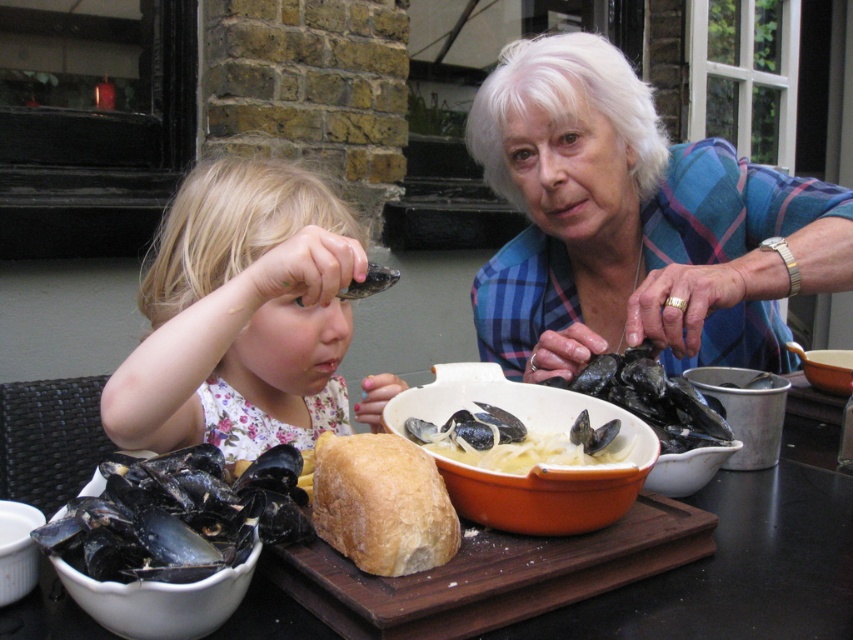
Question: Among these points, which one is farthest from the camera?

Choices:
 (A) (572, 605)
 (B) (637, 371)
 (C) (567, 250)
 (D) (184, 518)

Answer: (C)

Question: Is blonde hair at left bigger than white glossy bowl at lower left?

Choices:
 (A) yes
 (B) no

Answer: (A)

Question: Which point is closer to the camera taking this photo?

Choices:
 (A) (404, 488)
 (B) (399, 413)
 (C) (9, 540)
 (D) (123, 404)

Answer: (A)

Question: Where is wooden cutting board at center located in relation to black glossy oyster at center in the image?

Choices:
 (A) left
 (B) right

Answer: (A)

Question: Is orange ceramic bowl at center above white ceramic bowl at lower left?

Choices:
 (A) no
 (B) yes

Answer: (B)

Question: Which of the following is the farthest from the observer?

Choices:
 (A) (230, 349)
 (B) (751, 387)
 (C) (119, 484)

Answer: (B)